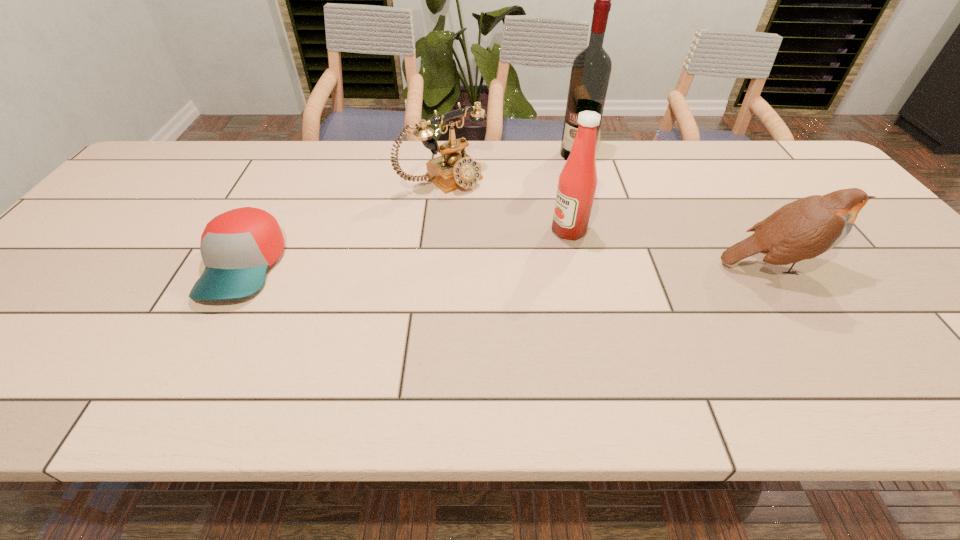
What are the coordinates of `vacant spot on the desktop that is between the baseball cap and the rightmost object and is positioned on the front-facing side of the second tallest object` in the screenshot? It's located at click(x=482, y=266).

I want to click on free space on the desktop that is between the baseball cap and the rightmost object and is positioned on the front and back of the alcohol, so click(478, 266).

In order to click on vacant spot on the desktop that is between the leftmost object and the rightmost object and is positioned on the dial number of the fourth object from right to left in this screenshot , I will do `click(546, 265)`.